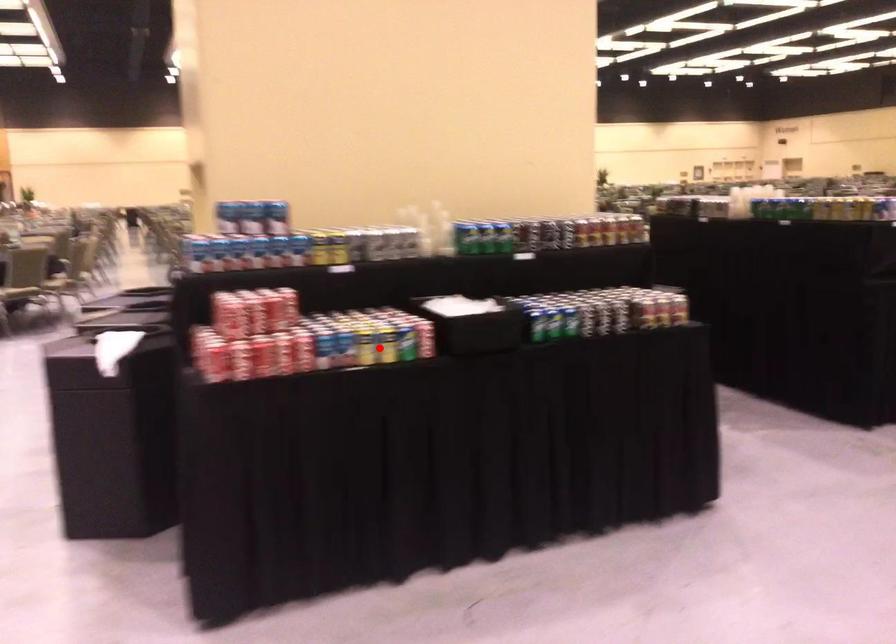
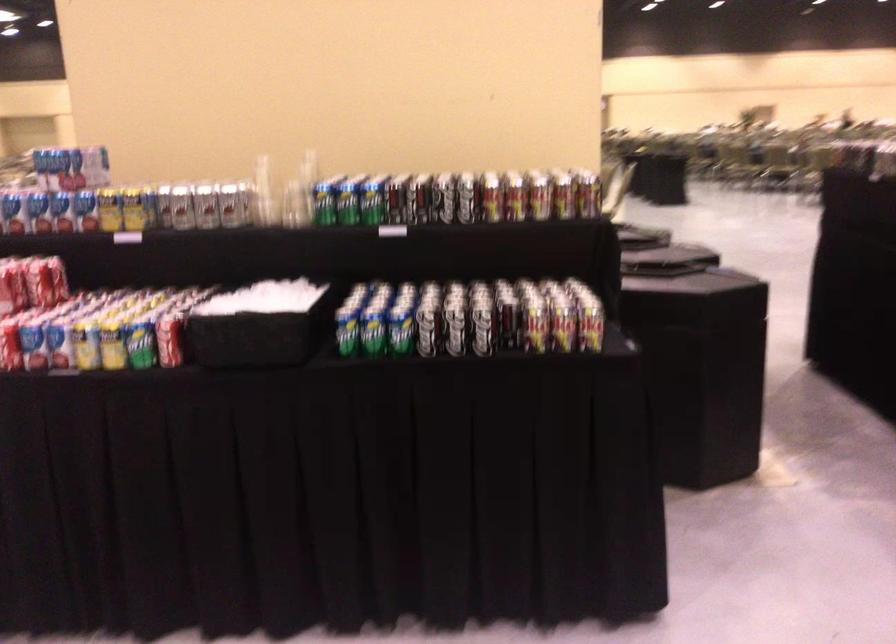
Question: I am providing you with two images of the same scene from different viewpoints. A red point is marked on the first image. Is the red point's position out of view in image 2?

Choices:
 (A) Yes
 (B) No

Answer: (B)